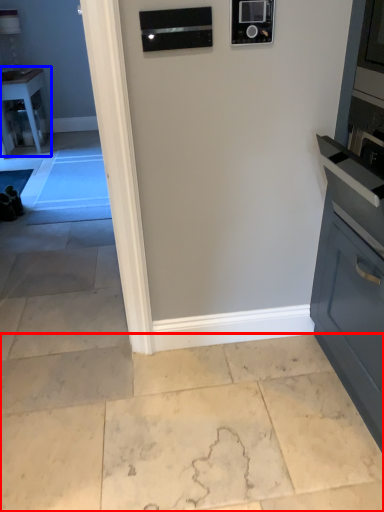
Question: Among these objects, which one is farthest to the camera, concrete (highlighted by a red box) or table (highlighted by a blue box)?

Choices:
 (A) concrete
 (B) table

Answer: (B)